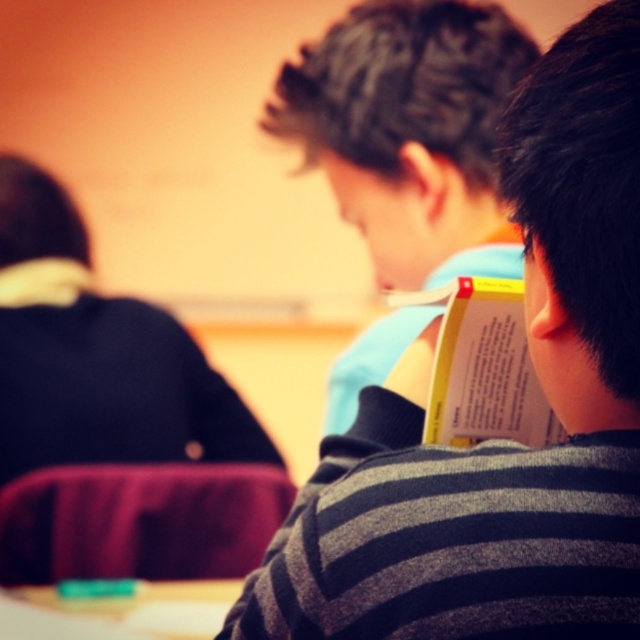
You are a student sitting at a desk in the classroom. You need to reach for the green plastic eraser at lower left but there is a yellow paper book at center in the way. Can you move the book to access the eraser?

The yellow paper book at center is above the green plastic eraser at lower left, so you can move the book downward to access the eraser.

You are a student in the classroom and need to determine which object takes up more space in the image. Which one is bigger between the dark blue sweater at left and the green plastic eraser at lower left?

The dark blue sweater at left is larger in size than the green plastic eraser at lower left, so the dark blue sweater at left takes up more space in the image.